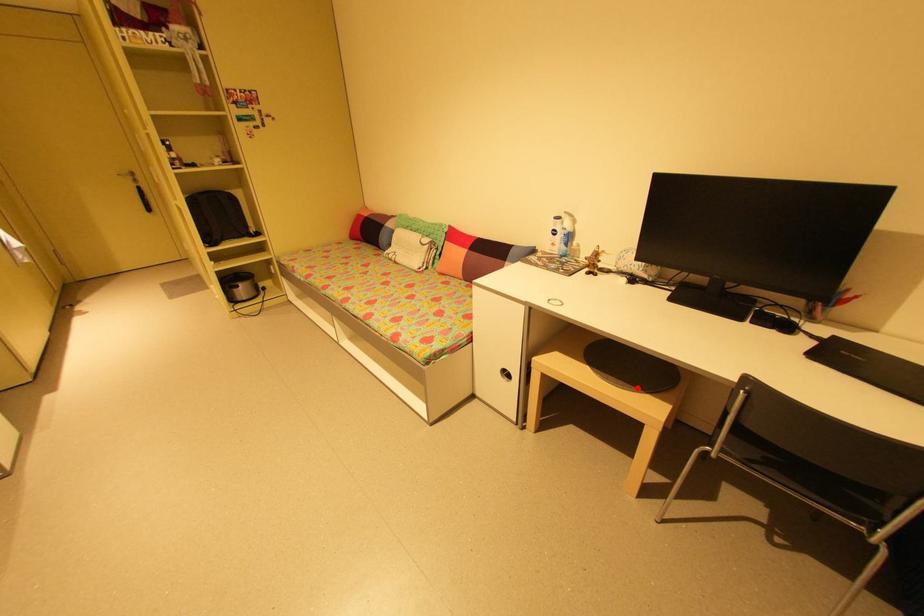
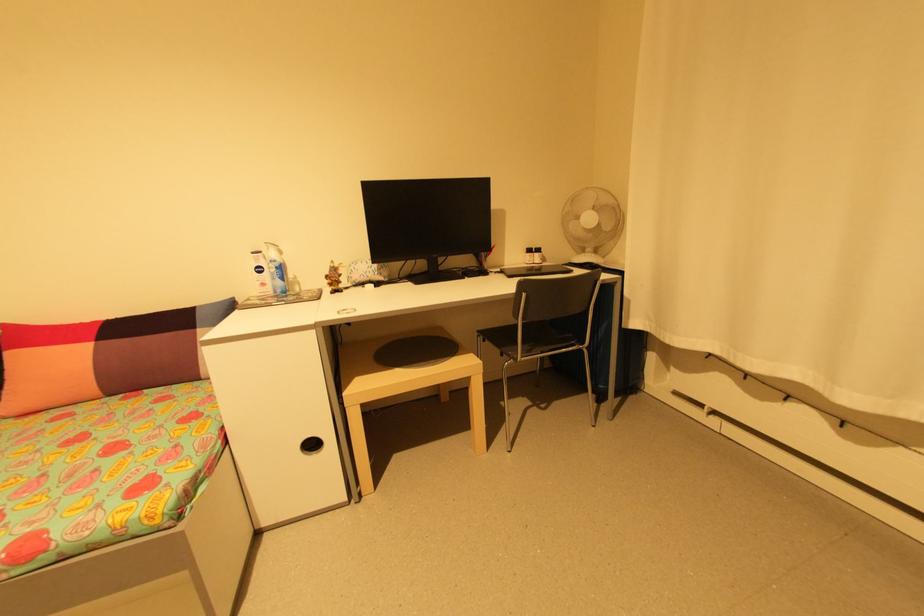
In the second image, find the point that corresponds to the highlighted location in the first image.

(445, 360)